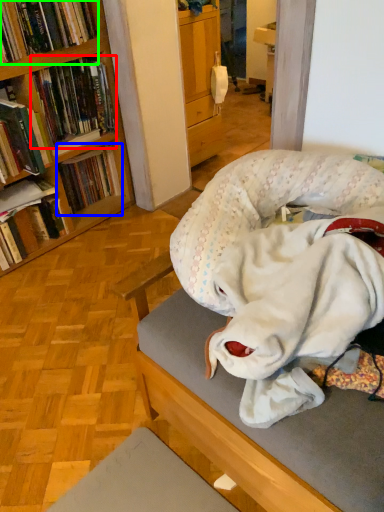
Question: Which object is positioned closest to book (highlighted by a red box)? Select from book (highlighted by a blue box) and book (highlighted by a green box).

Choices:
 (A) book
 (B) book

Answer: (B)